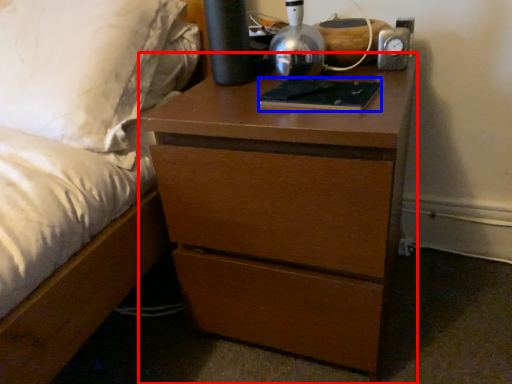
Question: Which point is further to the camera, chest of drawers (highlighted by a red box) or book (highlighted by a blue box)?

Choices:
 (A) chest of drawers
 (B) book

Answer: (B)